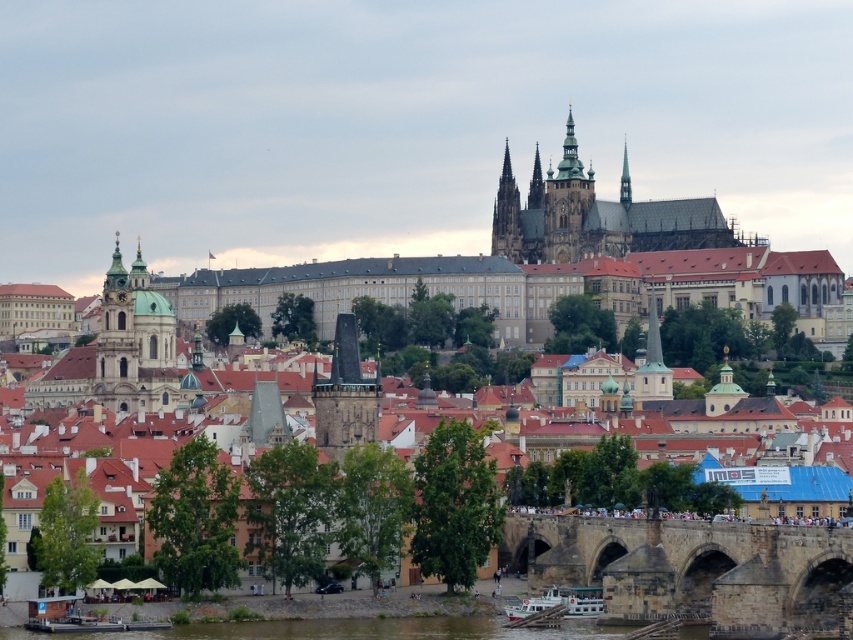
You are standing on the Charles Bridge and looking towards the golden spires at center and dark gray stone spire at center. Which one appears higher in the scene?

The golden spires at center appears higher because it is positioned over the dark gray stone spire at center.